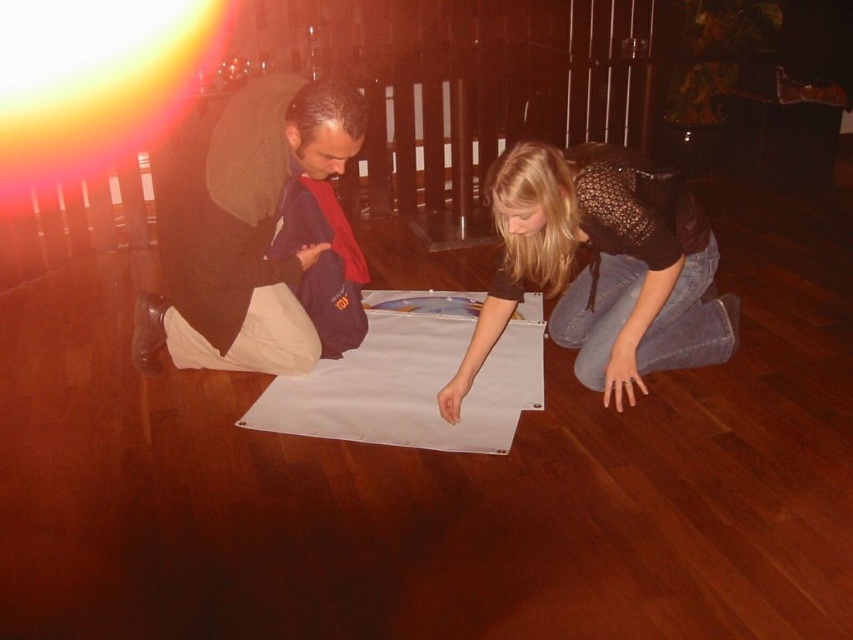
You are a photographer setting up for a photoshoot. You have two cloths available for the background setup. The dark blue fabric at left and the white matte cloth at center. Which cloth is placed higher in the image?

The dark blue fabric at left is located above the white matte cloth at center, so it is placed higher in the image.

You are a photographer setting up for a photo shoot. You need to place a small prop between the denim jeans at lower right and the white matte cloth at center. According to the scene, where should you place it to ensure it is between them?

The denim jeans at lower right is positioned on the right side of white matte cloth at center, so place the prop to the right of the white matte cloth at center but left of the denim jeans at lower right to keep it between them.

You are a person standing in the room and see the dark blue fabric at left and the white matte cloth at center. Which one is positioned to the left side of the other?

The dark blue fabric at left is positioned to the left of the white matte cloth at center.